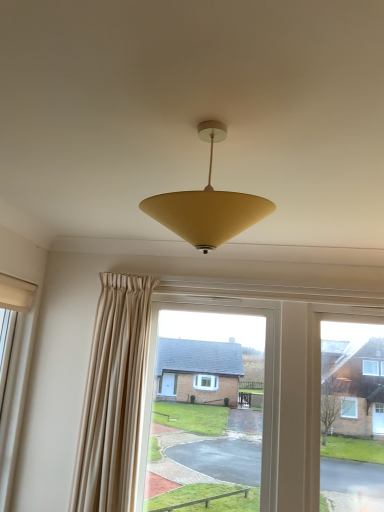
Question: Does white matte window at left have a greater height compared to matte yellow cone at center?

Choices:
 (A) yes
 (B) no

Answer: (A)

Question: Can you confirm if white matte window at left is shorter than matte yellow cone at center?

Choices:
 (A) yes
 (B) no

Answer: (B)

Question: Considering the relative sizes of white matte window at left and matte yellow cone at center in the image provided, is white matte window at left wider than matte yellow cone at center?

Choices:
 (A) no
 (B) yes

Answer: (A)

Question: Is white matte window at left facing away from matte yellow cone at center?

Choices:
 (A) no
 (B) yes

Answer: (A)

Question: Is white matte window at left to the left of matte yellow cone at center from the viewer's perspective?

Choices:
 (A) yes
 (B) no

Answer: (A)

Question: Is white matte window at left surrounding matte yellow cone at center?

Choices:
 (A) yes
 (B) no

Answer: (B)

Question: Does matte yellow cone at center appear on the left side of white matte window at left?

Choices:
 (A) no
 (B) yes

Answer: (A)

Question: Considering the relative sizes of matte yellow cone at center and white matte window at left in the image provided, is matte yellow cone at center taller than white matte window at left?

Choices:
 (A) no
 (B) yes

Answer: (A)

Question: Is the surface of matte yellow cone at center in direct contact with white matte window at left?

Choices:
 (A) yes
 (B) no

Answer: (B)

Question: Are matte yellow cone at center and white matte window at left far apart?

Choices:
 (A) no
 (B) yes

Answer: (B)

Question: Is white matte window at left completely or partially inside matte yellow cone at center?

Choices:
 (A) no
 (B) yes

Answer: (A)

Question: From the image's perspective, does matte yellow cone at center appear lower than white matte window at left?

Choices:
 (A) yes
 (B) no

Answer: (B)

Question: Is matte yellow cone at center inside or outside of white matte window at left?

Choices:
 (A) outside
 (B) inside

Answer: (A)